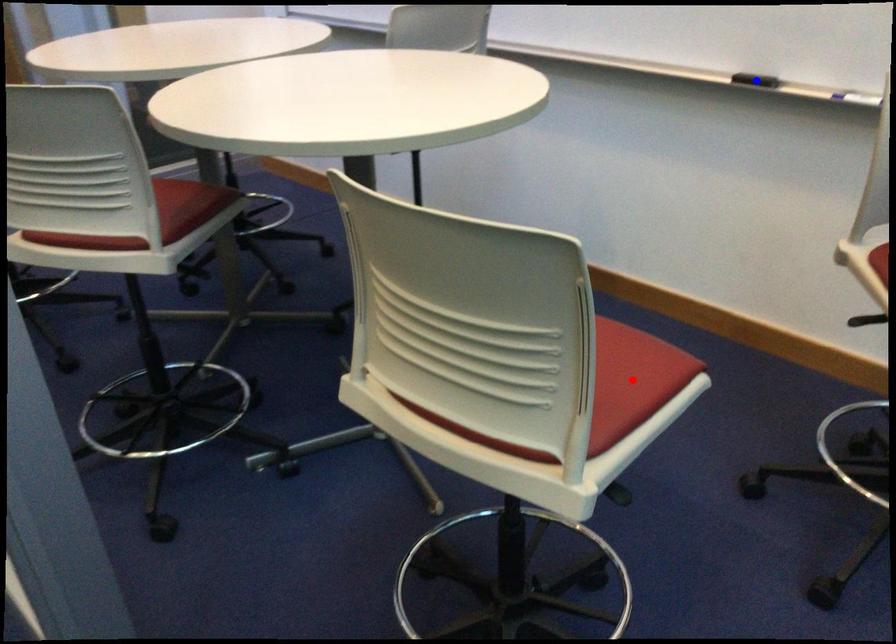
Question: Two points are marked on the image. Which point is closer to the camera?

Choices:
 (A) Blue point is closer.
 (B) Red point is closer.

Answer: (B)